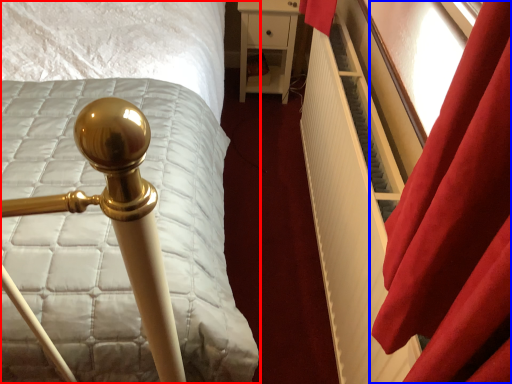
Question: Which point is further to the camera, bed (highlighted by a red box) or curtain (highlighted by a blue box)?

Choices:
 (A) bed
 (B) curtain

Answer: (B)